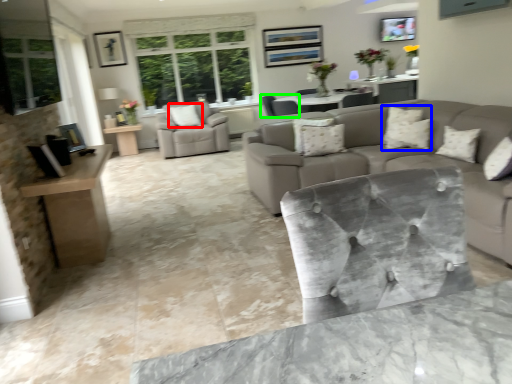
Question: Which is nearer to the pillow (highlighted by a red box)? pillow (highlighted by a blue box) or chair (highlighted by a green box).

Choices:
 (A) pillow
 (B) chair

Answer: (B)